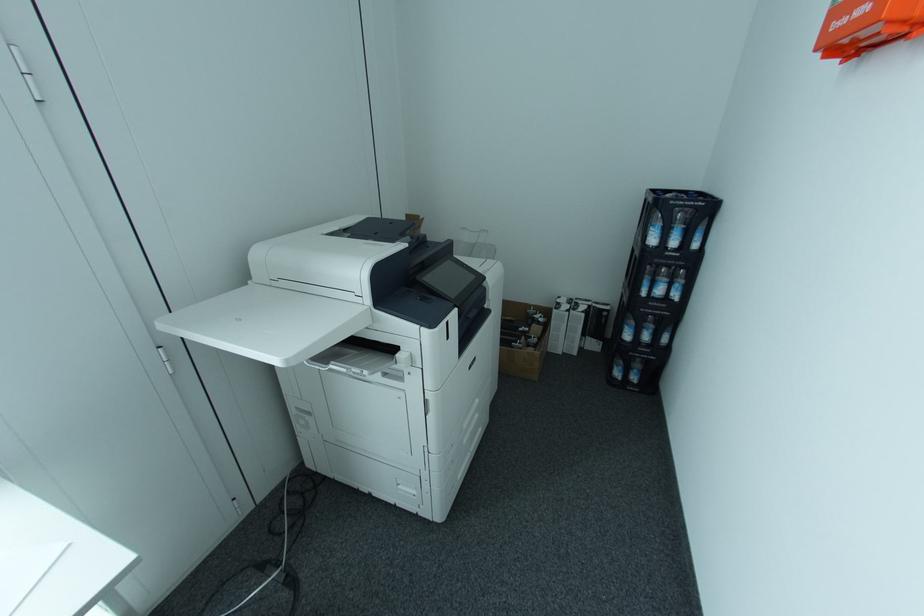
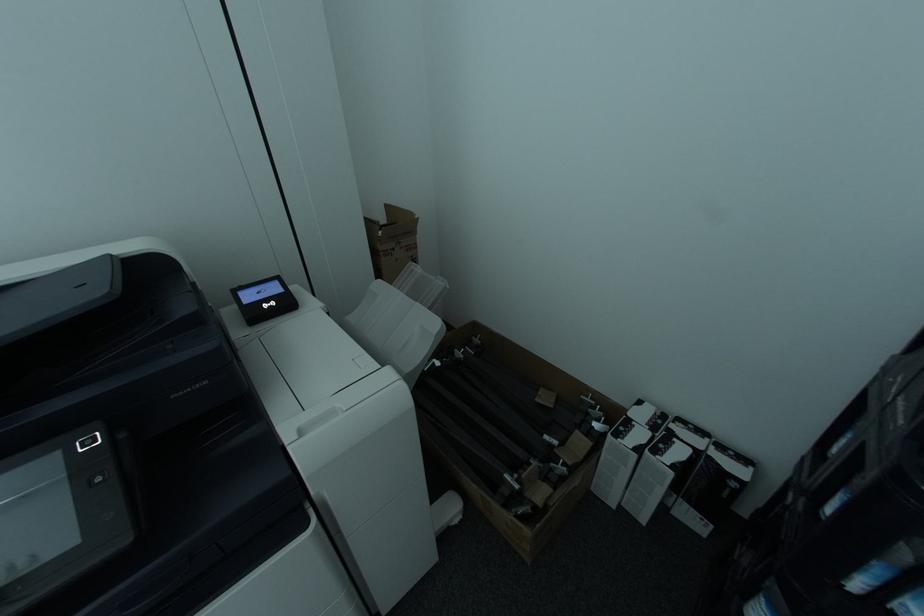
The images are taken continuously from a first-person perspective. In which direction are you moving?

The cameraman moved toward right, forward.